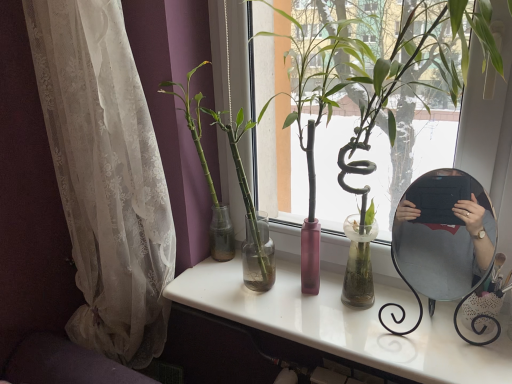
You are a GUI agent. You are given a task and a screenshot of the screen. Output one action in this format:
    pyautogui.click(x=<x>, y=<y>)
    Task: Click on the metallic silver mirror at right
    The width and height of the screenshot is (512, 384).
    Given the screenshot: What is the action you would take?
    pyautogui.click(x=445, y=239)

You are a GUI agent. You are given a task and a screenshot of the screen. Output one action in this format:
    pyautogui.click(x=<x>, y=<y>)
    Task: Click on the green glossy bamboo at center, which is the second houseplant from left to right
    This screenshot has width=512, height=384.
    Given the screenshot: What is the action you would take?
    pyautogui.click(x=376, y=74)

What are the coordinates of `white glossy desk at center` in the screenshot? It's located at (346, 323).

Which of these two, white lace curtain at left or green glass vase at center, which is the 1th houseplant in left-to-right order, is thinner?

Thinner between the two is green glass vase at center, which is the 1th houseplant in left-to-right order.

Is white lace curtain at left oriented away from green glass vase at center, which ranks as the 2th houseplant in right-to-left order?

white lace curtain at left does not have its back to green glass vase at center, which ranks as the 2th houseplant in right-to-left order.

Who is taller, white lace curtain at left or green glass vase at center, which ranks as the 2th houseplant in right-to-left order?

white lace curtain at left.

Is white lace curtain at left located outside green glass vase at center, which is the 1th houseplant in left-to-right order?

white lace curtain at left lies outside green glass vase at center, which is the 1th houseplant in left-to-right order,'s area.

How distant is white glossy desk at center from metallic silver mirror at right?

white glossy desk at center is 9.98 inches from metallic silver mirror at right.

Is white glossy desk at center to the right of metallic silver mirror at right from the viewer's perspective?

No.

Which is more distant, (389,350) or (451,247)?

The point (451,247) is behind.

Can you confirm if white lace curtain at left is bigger than white glossy desk at center?

Yes, white lace curtain at left is bigger than white glossy desk at center.

From a real-world perspective, between white lace curtain at left and white glossy desk at center, who is vertically higher?

From a 3D spatial view, white lace curtain at left is above.

Between white lace curtain at left and white glossy desk at center, which one is positioned behind?

Positioned behind is white lace curtain at left.

From a real-world perspective, is metallic silver mirror at right above or below green glass vase at center, which ranks as the 2th houseplant in right-to-left order?

metallic silver mirror at right is below green glass vase at center, which ranks as the 2th houseplant in right-to-left order.

Considering the sizes of objects metallic silver mirror at right and green glass vase at center, which ranks as the 2th houseplant in right-to-left order, in the image provided, who is shorter, metallic silver mirror at right or green glass vase at center, which ranks as the 2th houseplant in right-to-left order,?

With less height is metallic silver mirror at right.

Is metallic silver mirror at right spatially inside green glass vase at center, which ranks as the 2th houseplant in right-to-left order, or outside of it?

metallic silver mirror at right is not enclosed by green glass vase at center, which ranks as the 2th houseplant in right-to-left order.

Is metallic silver mirror at right aimed at green glass vase at center, which ranks as the 2th houseplant in right-to-left order?

No, metallic silver mirror at right is not turned towards green glass vase at center, which ranks as the 2th houseplant in right-to-left order.

Is green glass vase at center, which is the 1th houseplant in left-to-right order, situated inside white glossy desk at center or outside?

green glass vase at center, which is the 1th houseplant in left-to-right order, exists outside the volume of white glossy desk at center.

Is green glass vase at center, which is the 1th houseplant in left-to-right order, far away from white glossy desk at center?

green glass vase at center, which is the 1th houseplant in left-to-right order, is actually quite close to white glossy desk at center.

Between green glass vase at center, which is the 1th houseplant in left-to-right order, and white glossy desk at center, which one appears on the right side from the viewer's perspective?

white glossy desk at center.

Is white lace curtain at left with metallic silver mirror at right?

white lace curtain at left and metallic silver mirror at right are clearly separated.

Can you tell me how much white lace curtain at left and metallic silver mirror at right differ in facing direction?

white lace curtain at left and metallic silver mirror at right are facing 12.9 degrees away from each other.

Can you confirm if white lace curtain at left is wider than metallic silver mirror at right?

Yes.

Does white lace curtain at left appear on the left side of metallic silver mirror at right?

Correct, you'll find white lace curtain at left to the left of metallic silver mirror at right.

Which is more to the left, green glossy bamboo at center, which is the second houseplant from left to right, or white lace curtain at left?

Positioned to the left is white lace curtain at left.

In the image, is green glossy bamboo at center, which is the second houseplant from left to right, positioned in front of or behind white lace curtain at left?

Clearly, green glossy bamboo at center, which is the second houseplant from left to right, is in front of white lace curtain at left.

Who is shorter, green glossy bamboo at center, arranged as the 1th houseplant when viewed from the right, or white lace curtain at left?

green glossy bamboo at center, arranged as the 1th houseplant when viewed from the right.

Who is smaller, green glossy bamboo at center, arranged as the 1th houseplant when viewed from the right, or white lace curtain at left?

With smaller size is white lace curtain at left.

I want to click on curtain in front of the green glass vase at center, which ranks as the 2th houseplant in right-to-left order, so click(x=105, y=176).

In the image, there is a metallic silver mirror at right. In order to click on desk below it (from the image's perspective) in this screenshot , I will do `click(346, 323)`.

Estimate the real-world distances between objects in this image. Which object is further from white glossy desk at center, metallic silver mirror at right or green glossy bamboo at center, arranged as the 1th houseplant when viewed from the right?

The object further to white glossy desk at center is green glossy bamboo at center, arranged as the 1th houseplant when viewed from the right.

Looking at the image, which one is located further to metallic silver mirror at right, white lace curtain at left or green glossy bamboo at center, which is the second houseplant from left to right?

Among the two, white lace curtain at left is located further to metallic silver mirror at right.

Based on their spatial positions, is green glass vase at center, which ranks as the 2th houseplant in right-to-left order, or metallic silver mirror at right further from white glossy desk at center?

green glass vase at center, which ranks as the 2th houseplant in right-to-left order, is further to white glossy desk at center.

From the image, which object appears to be farther from green glossy bamboo at center, arranged as the 1th houseplant when viewed from the right, metallic silver mirror at right or white glossy desk at center?

Among the two, white glossy desk at center is located further to green glossy bamboo at center, arranged as the 1th houseplant when viewed from the right.

Which object lies further to the anchor point green glass vase at center, which is the 1th houseplant in left-to-right order, white lace curtain at left or green glossy bamboo at center, which is the second houseplant from left to right?

The object further to green glass vase at center, which is the 1th houseplant in left-to-right order, is green glossy bamboo at center, which is the second houseplant from left to right.

Considering their positions, is white lace curtain at left positioned closer to green glossy bamboo at center, arranged as the 1th houseplant when viewed from the right, than white glossy desk at center?

The object closer to green glossy bamboo at center, arranged as the 1th houseplant when viewed from the right, is white glossy desk at center.

Based on their spatial positions, is green glossy bamboo at center, which is the second houseplant from left to right, or metallic silver mirror at right further from white glossy desk at center?

Based on the image, green glossy bamboo at center, which is the second houseplant from left to right, appears to be further to white glossy desk at center.

When comparing their distances from green glass vase at center, which is the 1th houseplant in left-to-right order, does white lace curtain at left or metallic silver mirror at right seem closer?

The object closer to green glass vase at center, which is the 1th houseplant in left-to-right order, is white lace curtain at left.

The height and width of the screenshot is (384, 512). Find the location of `desk positioned between green glossy bamboo at center, which is the second houseplant from left to right, and metallic silver mirror at right from near to far`. desk positioned between green glossy bamboo at center, which is the second houseplant from left to right, and metallic silver mirror at right from near to far is located at coordinates (346, 323).

Image resolution: width=512 pixels, height=384 pixels. I want to click on houseplant located between white lace curtain at left and green glossy bamboo at center, arranged as the 1th houseplant when viewed from the right, in the left-right direction, so click(234, 166).

At what (x,y) coordinates should I click in order to perform the action: click on desk between white lace curtain at left and metallic silver mirror at right. Please return your answer as a coordinate pair (x, y). Looking at the image, I should click on (346, 323).

You are a GUI agent. You are given a task and a screenshot of the screen. Output one action in this format:
    pyautogui.click(x=<x>, y=<y>)
    Task: Click on the desk between green glass vase at center, which ranks as the 2th houseplant in right-to-left order, and green glossy bamboo at center, arranged as the 1th houseplant when viewed from the right
    This screenshot has width=512, height=384.
    Given the screenshot: What is the action you would take?
    pyautogui.click(x=346, y=323)